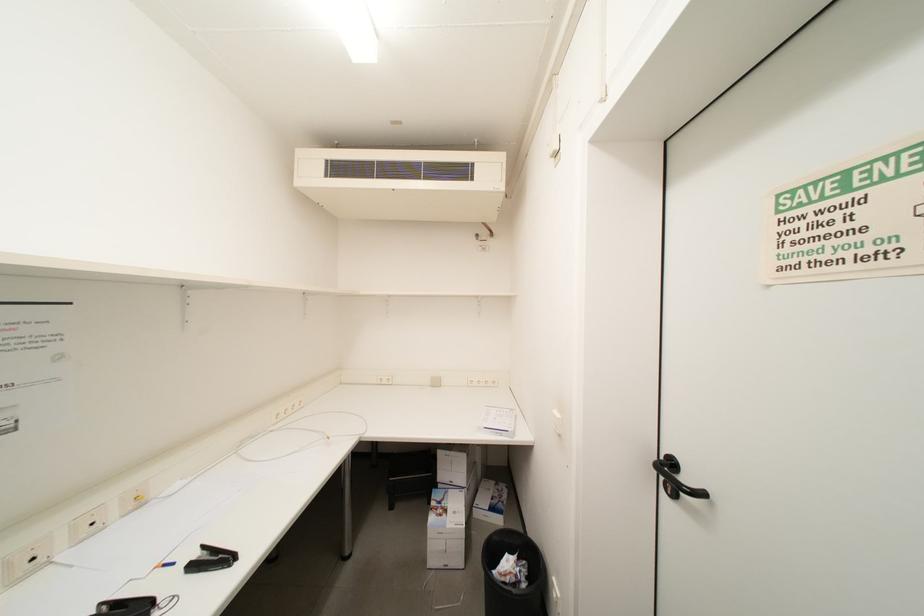
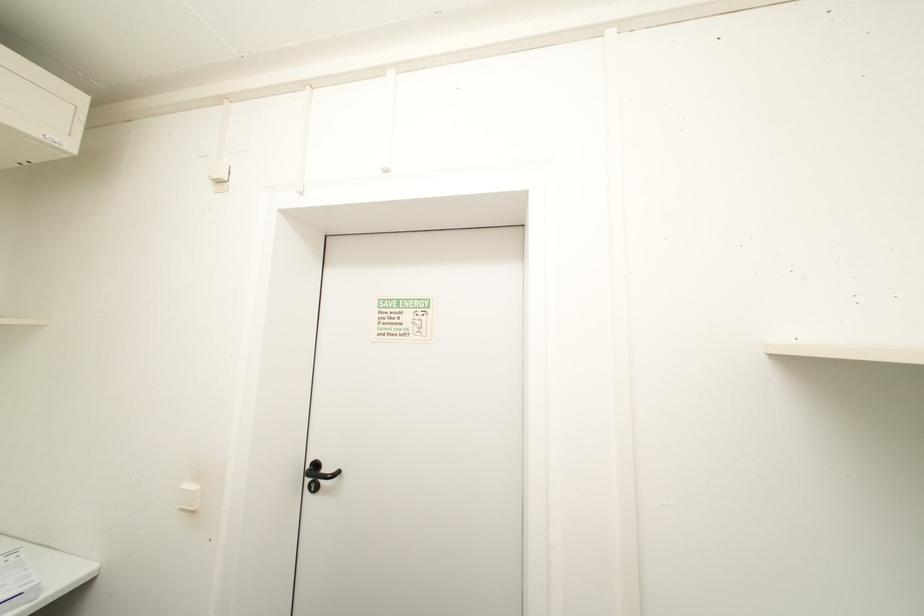
Question: The images are taken continuously from a first-person perspective. In which direction is your viewpoint rotating?

Choices:
 (A) Left
 (B) Right
 (C) Up
 (D) Down

Answer: (B)